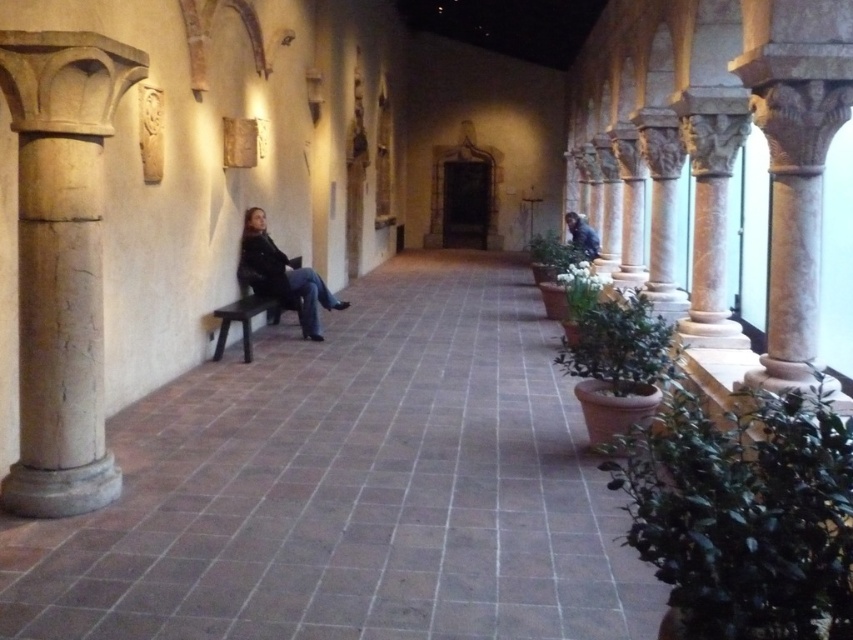
Between light beige stone column at left and dark blue jeans at center, which one has more height?

light beige stone column at left is taller.

From the picture: Does light beige stone column at left have a greater height compared to dark blue jeans at center?

Yes.

At what (x,y) coordinates should I click in order to perform the action: click on light beige stone column at left. Please return your answer as a coordinate pair (x, y). Looking at the image, I should click on (61, 262).

Find the location of a particular element. The width and height of the screenshot is (853, 640). brown stone bench at left is located at coordinates point(352,486).

Does point (341, 428) lie in front of point (576, 228)?

Yes, it is in front of point (576, 228).

The height and width of the screenshot is (640, 853). Find the location of `brown stone bench at left`. brown stone bench at left is located at coordinates (352, 486).

From the picture: Between brown stone bench at left and dark brown wooden bench at left, which one is positioned higher?

Positioned higher is dark brown wooden bench at left.

Between brown stone bench at left and dark brown wooden bench at left, which one has less height?

dark brown wooden bench at left is shorter.

Who is more forward, (369, 356) or (276, 300)?

Positioned in front is point (369, 356).

At what (x,y) coordinates should I click in order to perform the action: click on brown stone bench at left. Please return your answer as a coordinate pair (x, y). Image resolution: width=853 pixels, height=640 pixels. Looking at the image, I should click on (352, 486).